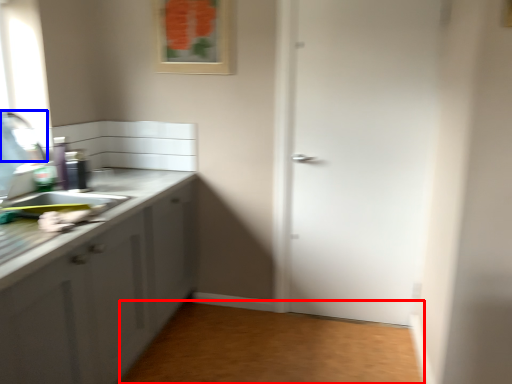
Question: Among these objects, which one is farthest to the camera, plain (highlighted by a red box) or faucet (highlighted by a blue box)?

Choices:
 (A) plain
 (B) faucet

Answer: (A)